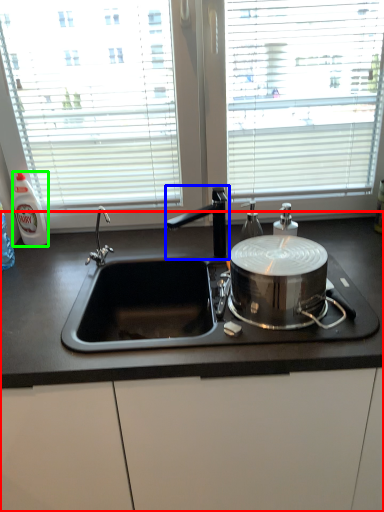
Question: Estimate the real-world distances between objects in this image. Which object is closer to countertop (highlighted by a red box), tap (highlighted by a blue box) or bottle (highlighted by a green box)?

Choices:
 (A) tap
 (B) bottle

Answer: (A)